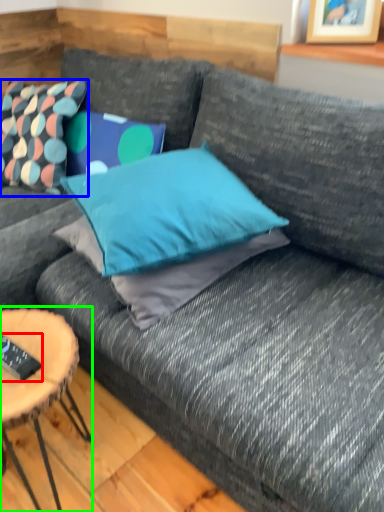
Question: Based on their relative distances, which object is farther from remote control (highlighted by a red box)? Choose from pillow (highlighted by a blue box) and coffee table (highlighted by a green box).

Choices:
 (A) pillow
 (B) coffee table

Answer: (A)